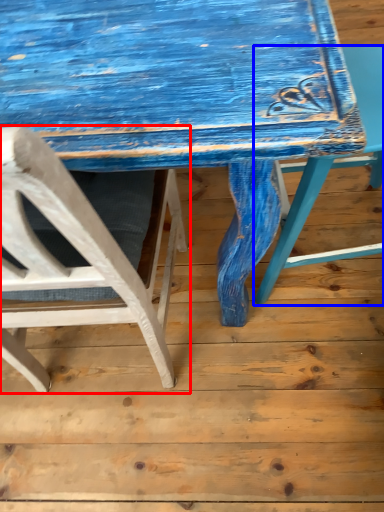
Question: Which object appears closest to the camera in this image, chair (highlighted by a red box) or chair (highlighted by a blue box)?

Choices:
 (A) chair
 (B) chair

Answer: (A)